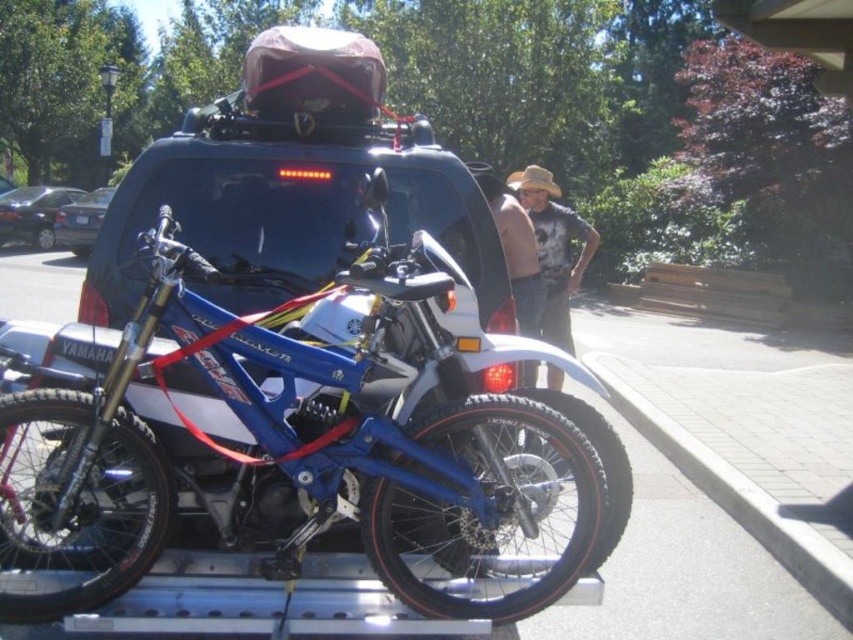
You are a photographer taking a picture of the motorcycle on the pickup truck. You notice a denim shirt at center and a tan straw hat at upper center in the frame. Which object is positioned higher in the image?

The denim shirt at center is above the tan straw hat at upper center, so the denim shirt at center is positioned higher in the image.

You are a delivery driver who needs to park your truck so that the blue metallic motorcycle at center and the shiny black sedan at left are both visible in your rearview mirror. Given that your rearview mirror has a 30 meter viewing range, will both vehicles be visible?

The blue metallic motorcycle at center is 20.42 meters from the shiny black sedan at left. Since the distance between them is within the 30 meter viewing range of the rearview mirror, both vehicles will be visible in the mirror.

From the picture: You are a delivery driver who needs to place a new tan straw hat at upper center in the truck bed. Where should you place it?

Place the tan straw hat at upper center at the coordinates point (515, 252) in the truck bed.